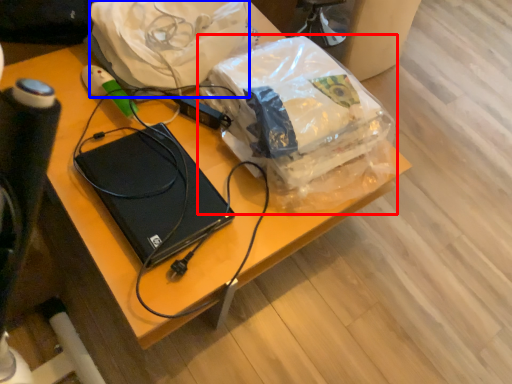
Question: Which object is further to the camera taking this photo, plastic bag (highlighted by a red box) or material (highlighted by a blue box)?

Choices:
 (A) plastic bag
 (B) material

Answer: (B)